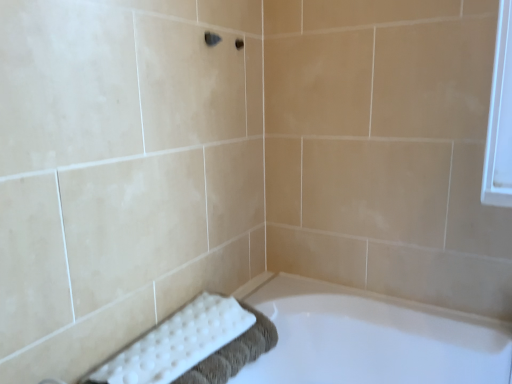
Question: Can you confirm if white glossy bathtub at lower center is shorter than white textured bath towel at lower left?

Choices:
 (A) yes
 (B) no

Answer: (B)

Question: From the image's perspective, does white glossy bathtub at lower center appear higher than white textured bath towel at lower left?

Choices:
 (A) yes
 (B) no

Answer: (B)

Question: Is white glossy bathtub at lower center wider than white textured bath towel at lower left?

Choices:
 (A) no
 (B) yes

Answer: (B)

Question: Would you consider white glossy bathtub at lower center to be distant from white textured bath towel at lower left?

Choices:
 (A) no
 (B) yes

Answer: (A)

Question: Can you confirm if white glossy bathtub at lower center is thinner than white textured bath towel at lower left?

Choices:
 (A) yes
 (B) no

Answer: (B)

Question: Would you say white glossy bathtub at lower center contains white textured bath towel at lower left?

Choices:
 (A) no
 (B) yes

Answer: (A)

Question: Does white textured bath towel at lower left appear on the right side of white glossy bathtub at lower center?

Choices:
 (A) yes
 (B) no

Answer: (B)

Question: From the image's perspective, is white textured bath towel at lower left below white glossy bathtub at lower center?

Choices:
 (A) yes
 (B) no

Answer: (B)

Question: Can you confirm if white textured bath towel at lower left is smaller than white glossy bathtub at lower center?

Choices:
 (A) no
 (B) yes

Answer: (B)

Question: Is white textured bath towel at lower left looking in the opposite direction of white glossy bathtub at lower center?

Choices:
 (A) yes
 (B) no

Answer: (B)

Question: From a real-world perspective, does white textured bath towel at lower left stand above white glossy bathtub at lower center?

Choices:
 (A) no
 (B) yes

Answer: (B)

Question: Is white textured bath towel at lower left at the left side of white glossy bathtub at lower center?

Choices:
 (A) no
 (B) yes

Answer: (B)

Question: Is point (195, 317) positioned closer to the camera than point (377, 324)?

Choices:
 (A) farther
 (B) closer

Answer: (B)